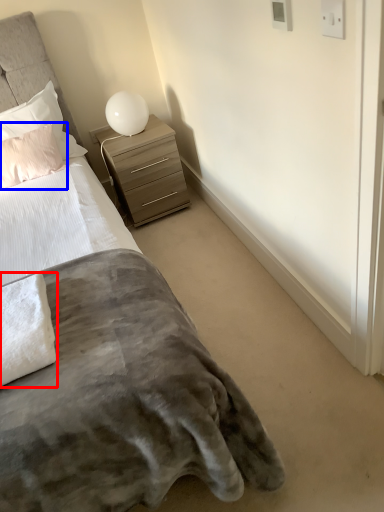
Question: Which point is further to the camera, material (highlighted by a red box) or pillow (highlighted by a blue box)?

Choices:
 (A) material
 (B) pillow

Answer: (B)